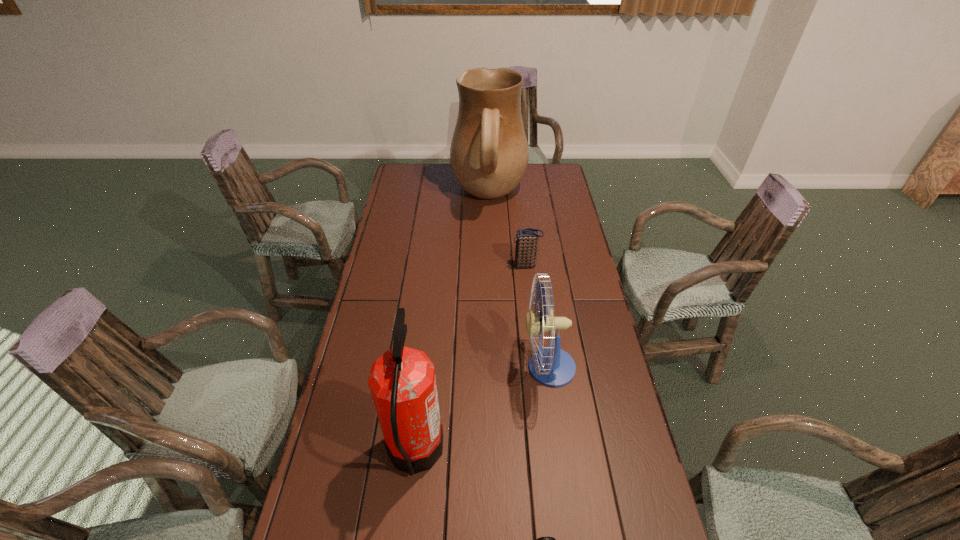
The height and width of the screenshot is (540, 960). I want to click on free spot located at the spout of the farthest object, so click(420, 197).

I want to click on blank space located on the front side of the second tallest object, so click(520, 452).

At what (x,y) coordinates should I click in order to perform the action: click on vacant area situated 0.200m at the front of the fan where the blades are visible. Please return your answer as a coordinate pair (x, y). The height and width of the screenshot is (540, 960). Looking at the image, I should click on (459, 367).

The width and height of the screenshot is (960, 540). In order to click on free location located 0.090m at the front of the fan where the blades are visible in this screenshot , I will do `click(493, 367)`.

Where is `vacant space situated at the front of the fan where the blades are visible`? This screenshot has height=540, width=960. vacant space situated at the front of the fan where the blades are visible is located at coordinates (402, 367).

The image size is (960, 540). In order to click on vacant space located 0.190m with the zip open on the farther clutch bag in this screenshot , I will do `click(465, 265)`.

Where is `free space located with the zip open on the farther clutch bag`? Image resolution: width=960 pixels, height=540 pixels. free space located with the zip open on the farther clutch bag is located at coordinates (424, 265).

This screenshot has height=540, width=960. I want to click on vacant region located 0.140m with the zip open on the farther clutch bag, so click(x=477, y=265).

Locate an element on the screen. The width and height of the screenshot is (960, 540). object situated at the far edge is located at coordinates (489, 153).

This screenshot has height=540, width=960. I want to click on object present at the right edge, so click(551, 366).